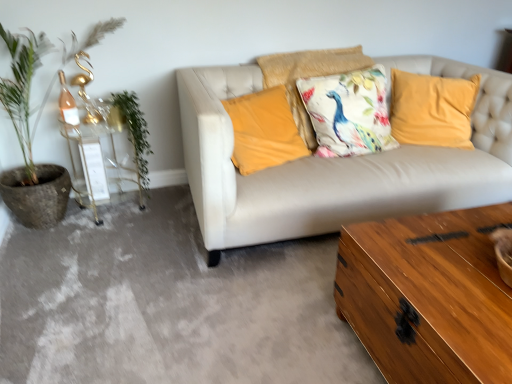
Question: Can you confirm if floral cotton cushion at center, which ranks as the 3th pillow in left-to-right order, is positioned to the left of velvet yellow pillow at center, placed as the 1th pillow when sorted from left to right?

Choices:
 (A) no
 (B) yes

Answer: (A)

Question: Is floral cotton cushion at center, which ranks as the 3th pillow in left-to-right order, oriented towards velvet yellow pillow at center, the 3th pillow when ordered from right to left?

Choices:
 (A) yes
 (B) no

Answer: (B)

Question: Would you say velvet yellow pillow at center, the 3th pillow when ordered from right to left, is part of floral cotton cushion at center, which ranks as the 3th pillow in left-to-right order,'s contents?

Choices:
 (A) no
 (B) yes

Answer: (A)

Question: Can you confirm if floral cotton cushion at center, marked as the 1th pillow in a right-to-left arrangement, is shorter than velvet yellow pillow at center, placed as the 1th pillow when sorted from left to right?

Choices:
 (A) no
 (B) yes

Answer: (A)

Question: Considering the relative sizes of floral cotton cushion at center, marked as the 1th pillow in a right-to-left arrangement, and velvet yellow pillow at center, the 3th pillow when ordered from right to left, in the image provided, is floral cotton cushion at center, marked as the 1th pillow in a right-to-left arrangement, taller than velvet yellow pillow at center, the 3th pillow when ordered from right to left,?

Choices:
 (A) no
 (B) yes

Answer: (B)

Question: Considering the positions of velvet yellow pillow at center, the 3th pillow when ordered from right to left, and floral cotton cushion at center, marked as the 1th pillow in a right-to-left arrangement, in the image, is velvet yellow pillow at center, the 3th pillow when ordered from right to left, wider or thinner than floral cotton cushion at center, marked as the 1th pillow in a right-to-left arrangement,?

Choices:
 (A) thin
 (B) wide

Answer: (A)

Question: In the image, is velvet yellow pillow at center, the 3th pillow when ordered from right to left, on the left side or the right side of floral cotton cushion at center, marked as the 1th pillow in a right-to-left arrangement?

Choices:
 (A) right
 (B) left

Answer: (B)

Question: Relative to floral cotton cushion at center, which ranks as the 3th pillow in left-to-right order, is velvet yellow pillow at center, placed as the 1th pillow when sorted from left to right, in front or behind?

Choices:
 (A) front
 (B) behind

Answer: (A)

Question: Is velvet yellow pillow at center, the 3th pillow when ordered from right to left, situated inside floral cotton cushion at center, which ranks as the 3th pillow in left-to-right order, or outside?

Choices:
 (A) outside
 (B) inside

Answer: (A)

Question: Would you say shiny brown wooden trunk at lower right is inside or outside green leafy plant at left?

Choices:
 (A) inside
 (B) outside

Answer: (B)

Question: Is shiny brown wooden trunk at lower right taller or shorter than green leafy plant at left?

Choices:
 (A) short
 (B) tall

Answer: (A)

Question: Considering the positions of shiny brown wooden trunk at lower right and green leafy plant at left in the image, is shiny brown wooden trunk at lower right bigger or smaller than green leafy plant at left?

Choices:
 (A) small
 (B) big

Answer: (B)

Question: From the image's perspective, is shiny brown wooden trunk at lower right above or below green leafy plant at left?

Choices:
 (A) below
 (B) above

Answer: (A)

Question: From a real-world perspective, relative to floral fabric cushion at center, which ranks as the second pillow in right-to-left order, is wooden chest at lower right vertically above or below?

Choices:
 (A) above
 (B) below

Answer: (B)

Question: Based on their positions, is wooden chest at lower right located to the left or right of floral fabric cushion at center, the 2th pillow positioned from the left?

Choices:
 (A) left
 (B) right

Answer: (A)